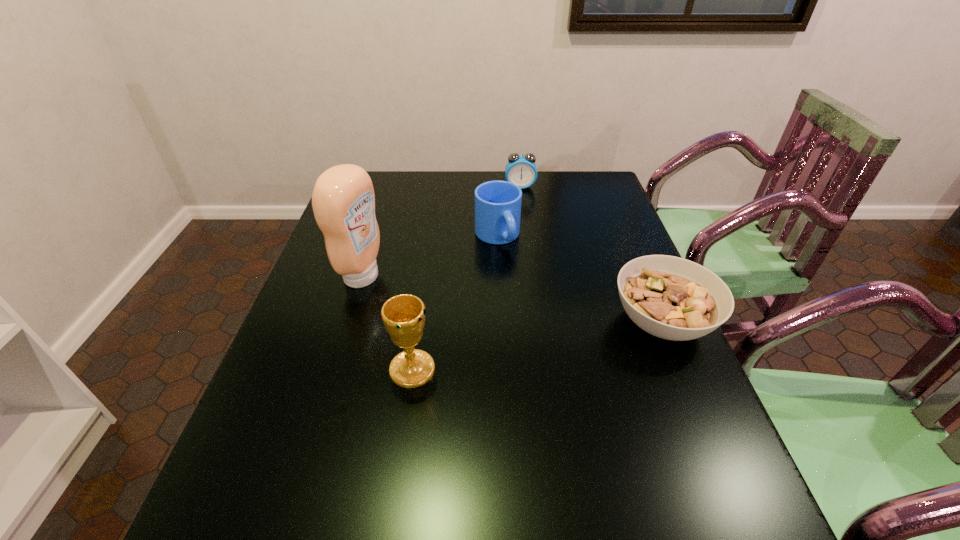
Where is `the second object from left to right`? The width and height of the screenshot is (960, 540). the second object from left to right is located at coordinates (403, 315).

Identify the location of chalice. (403, 315).

Locate an element on the screen. The width and height of the screenshot is (960, 540). stew is located at coordinates (672, 298).

I want to click on condiment, so click(343, 200).

I want to click on the leftmost object, so click(343, 200).

Where is `alarm clock`? The image size is (960, 540). alarm clock is located at coordinates (521, 170).

What are the coordinates of `the fourth nearest object` in the screenshot? It's located at click(x=497, y=203).

This screenshot has height=540, width=960. In order to click on vacant space located 0.090m on the left of the fourth shortest object in this screenshot , I will do `click(348, 369)`.

In order to click on vacant space located on the left of the stew in this screenshot , I will do `click(471, 322)`.

Locate an element on the screen. vacant space positioned on the label of the condiment is located at coordinates (517, 327).